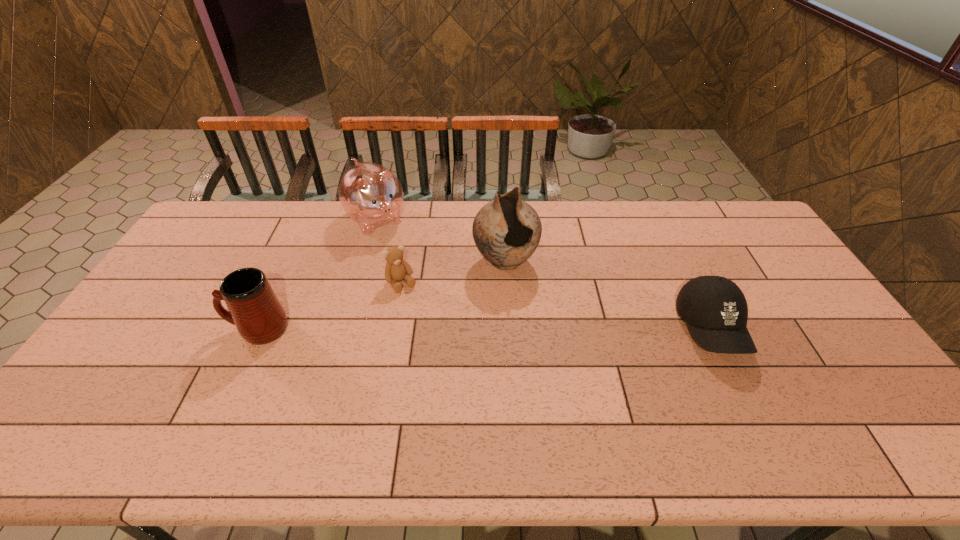
Identify the location of free space between the tallest object and the farthest object. The image size is (960, 540). pos(441,240).

I want to click on vacant space in between the third shortest object and the baseball cap, so click(485, 329).

Select which object appears as the fourth closest to the pottery. Please provide its 2D coordinates. Your answer should be formatted as a tuple, i.e. [(x, y)], where the tuple contains the x and y coordinates of a point satisfying the conditions above.

[(255, 310)]

Point out which object is positioned as the nearest to the farthest object. Please provide its 2D coordinates. Your answer should be formatted as a tuple, i.e. [(x, y)], where the tuple contains the x and y coordinates of a point satisfying the conditions above.

[(396, 269)]

Identify the location of free space that satisfies the following two spatial constraints: 1. on the front side of the farthest object; 2. on the left side of the tallest object. 364,261.

At what (x,y) coordinates should I click in order to perform the action: click on vacant area that satisfies the following two spatial constraints: 1. on the back side of the tallest object; 2. on the right side of the teddy bear. Please return your answer as a coordinate pair (x, y). The image size is (960, 540). Looking at the image, I should click on (406, 261).

Locate an element on the screen. vacant space that satisfies the following two spatial constraints: 1. on the front side of the second tallest object; 2. on the left side of the teddy bear is located at coordinates (358, 284).

The height and width of the screenshot is (540, 960). Identify the location of free location that satisfies the following two spatial constraints: 1. on the back side of the pottery; 2. on the right side of the teddy bear. (406, 261).